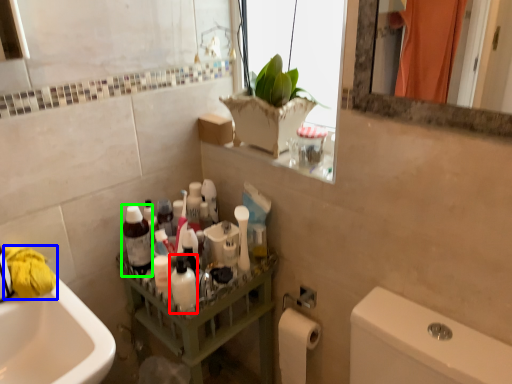
Question: Which object is positioned closest to mouthwash (highlighted by a red box)? Select from material (highlighted by a blue box) and bottle (highlighted by a green box).

Choices:
 (A) material
 (B) bottle

Answer: (B)